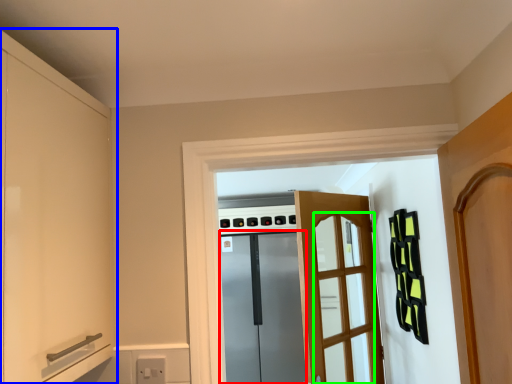
Question: Which is nearer to the screen door (highlighted by a red box)? cabinetry (highlighted by a blue box) or screen door (highlighted by a green box).

Choices:
 (A) cabinetry
 (B) screen door

Answer: (B)